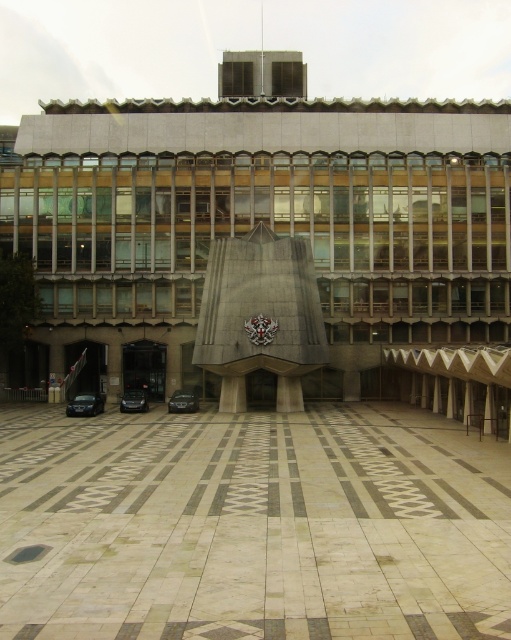
What do you see at coordinates (85, 404) in the screenshot? The width and height of the screenshot is (511, 640). I see `shiny black car at lower left` at bounding box center [85, 404].

Image resolution: width=511 pixels, height=640 pixels. Describe the element at coordinates (85, 404) in the screenshot. I see `shiny black car at lower left` at that location.

Where is `shiny black car at lower left`? This screenshot has width=511, height=640. shiny black car at lower left is located at coordinates (85, 404).

Describe the element at coordinates (251, 525) in the screenshot. The height and width of the screenshot is (640, 511). I see `beige stone plaza at center` at that location.

Locate an element on the screen. beige stone plaza at center is located at coordinates (251, 525).

Based on the photo, can you confirm if shiny silver car at center is wider than shiny black car at center?

No, shiny silver car at center is not wider than shiny black car at center.

Between point (169, 406) and point (123, 404), which one is positioned behind?

Point (169, 406)

Locate an element on the screen. shiny silver car at center is located at coordinates (182, 401).